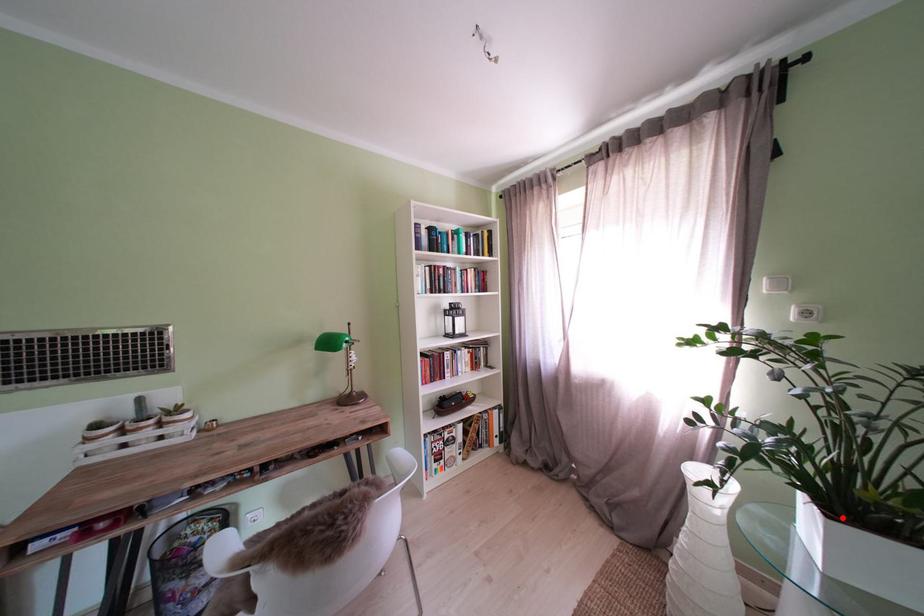
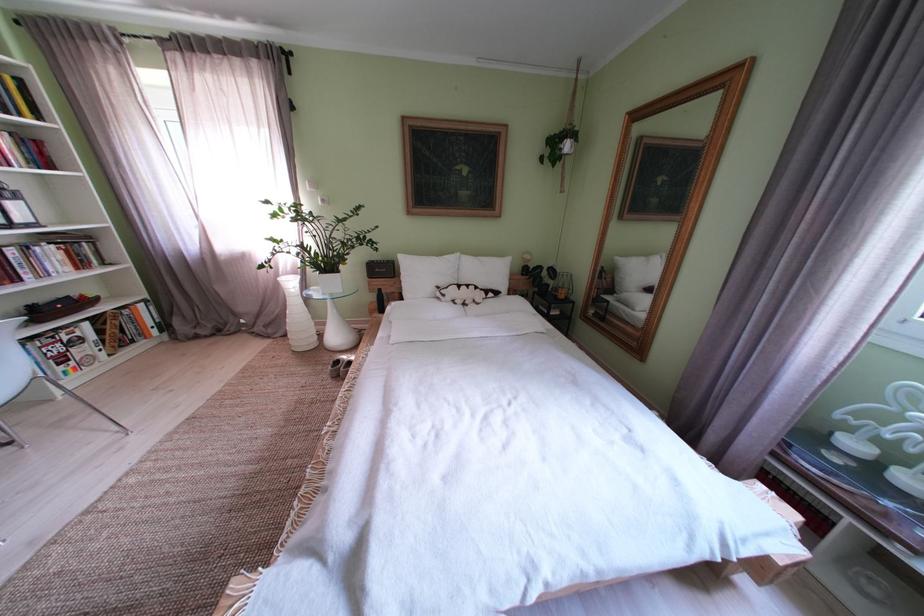
Question: I am providing you with two images of the same scene from different viewpoints. A red point is marked on the first image. At the location where the point appears in image 1, is it still visible in image 2?

Choices:
 (A) Yes
 (B) No

Answer: (A)